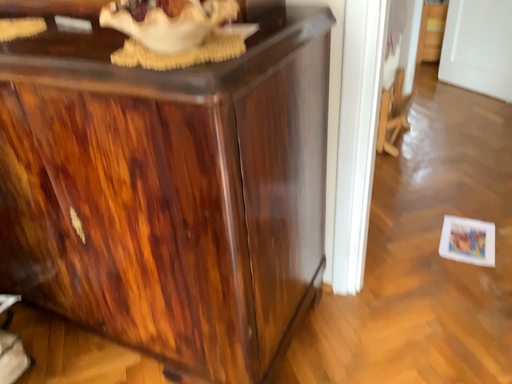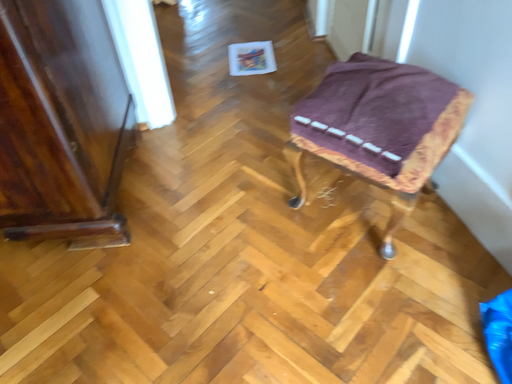
Question: How did the camera likely rotate when shooting the video?

Choices:
 (A) rotated right
 (B) rotated left

Answer: (A)